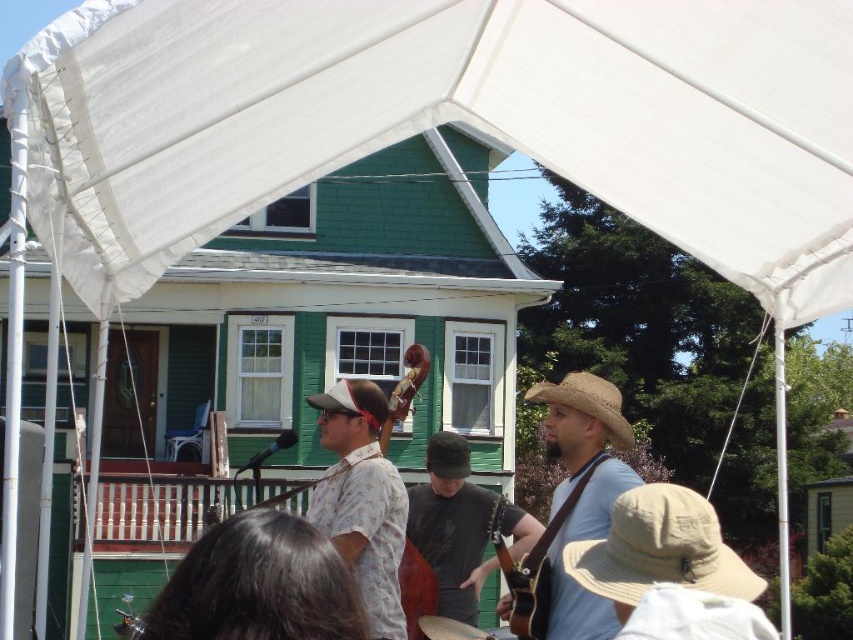
Question: Does light brown straw hat at center have a lesser width compared to dark gray cotton shirt at center?

Choices:
 (A) no
 (B) yes

Answer: (A)

Question: Among these points, which one is farthest from the camera?

Choices:
 (A) (268, 124)
 (B) (398, 576)
 (C) (630, 445)

Answer: (B)

Question: Considering the real-world distances, which object is farthest from the wooden acoustic guitar at lower right?

Choices:
 (A) brown straw hat at center
 (B) matte brown cello at center
 (C) dark gray cotton shirt at center
 (D) wooden slats at center

Answer: (D)

Question: Among these objects, which one is nearest to the camera?

Choices:
 (A) matte brown cello at center
 (B) brown straw hat at center
 (C) tan straw hat at lower right

Answer: (C)

Question: Can you confirm if matte brown cello at center is positioned to the left of brown straw hat at center?

Choices:
 (A) yes
 (B) no

Answer: (B)

Question: Is light brown straw hat at center further to the viewer compared to strawmaterial/texturehat at right?

Choices:
 (A) no
 (B) yes

Answer: (A)